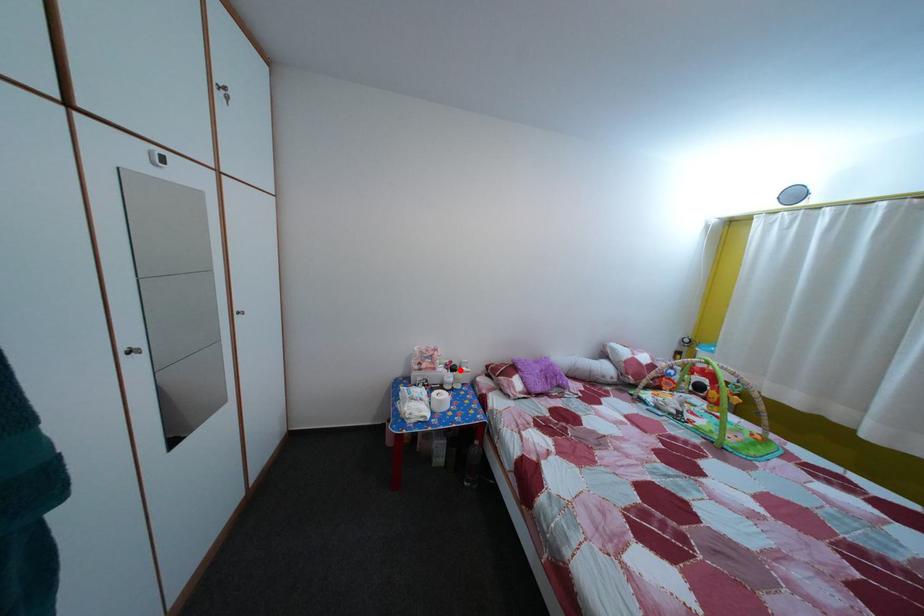
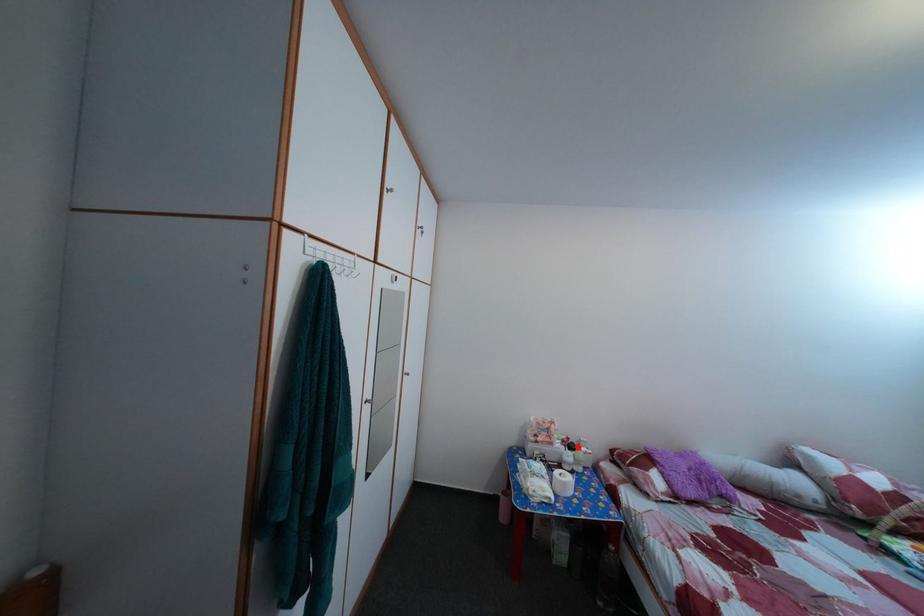
I am providing you with two images of the same scene from different viewpoints. A red point is marked on the first image and another point is marked on the second image. Does the point marked in image1 correspond to the same location as the one in image2?

Yes